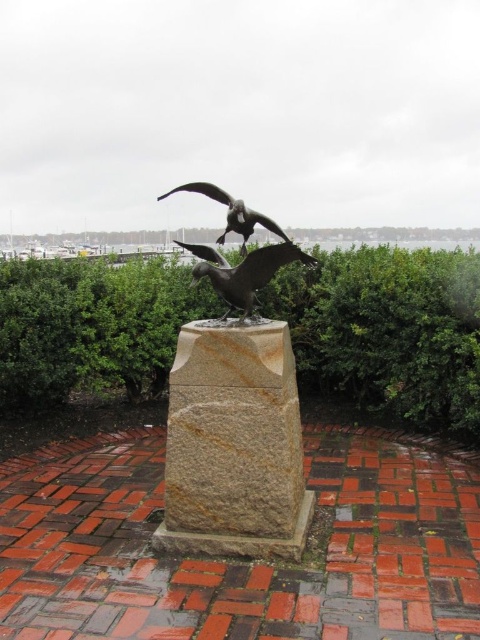
You are a gardener who needs to trim the green leafy hedge at center and the polished bronze bird at center. Which object requires you to use a ladder to reach its top?

The green leafy hedge at center is taller than the polished bronze bird at center, so you will need a ladder to trim the green leafy hedge at center.

You are a gardener planning to trim the green leafy hedge at center and the polished bronze bird at center. Which object requires more time to maintain its shape due to its size?

The green leafy hedge at center requires more time to maintain its shape because its width is larger than the polished bronze bird at center.